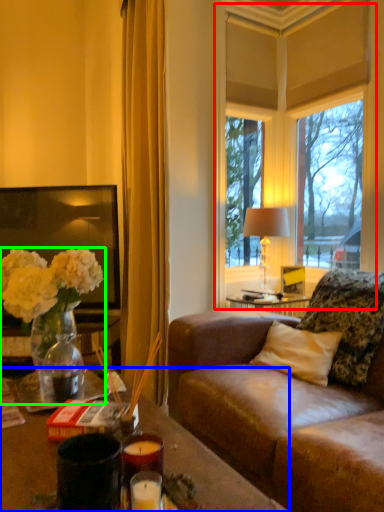
Question: Considering the real-world distances, which object is farthest from window (highlighted by a red box)? desk (highlighted by a blue box) or houseplant (highlighted by a green box)?

Choices:
 (A) desk
 (B) houseplant

Answer: (A)